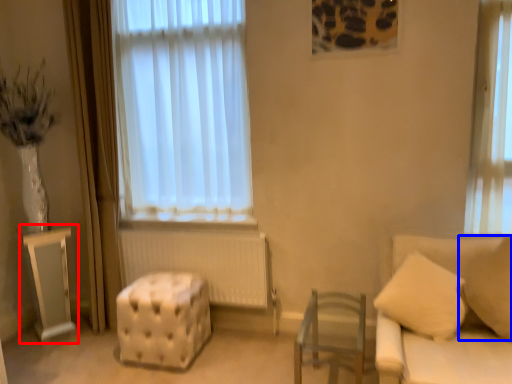
Question: Which point is closer to the camera, table (highlighted by a red box) or pillow (highlighted by a blue box)?

Choices:
 (A) table
 (B) pillow

Answer: (B)